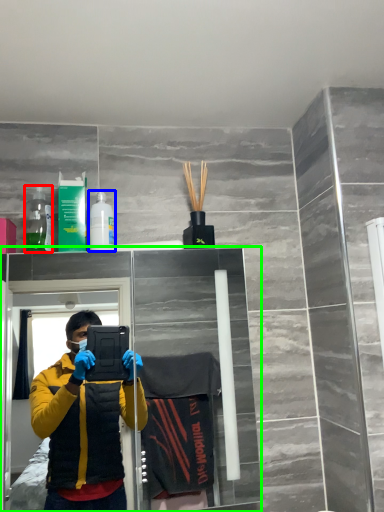
Question: Which object is the farthest from bottle (highlighted by a red box)? Choose among these: toiletry (highlighted by a blue box) or glass door (highlighted by a green box).

Choices:
 (A) toiletry
 (B) glass door

Answer: (B)